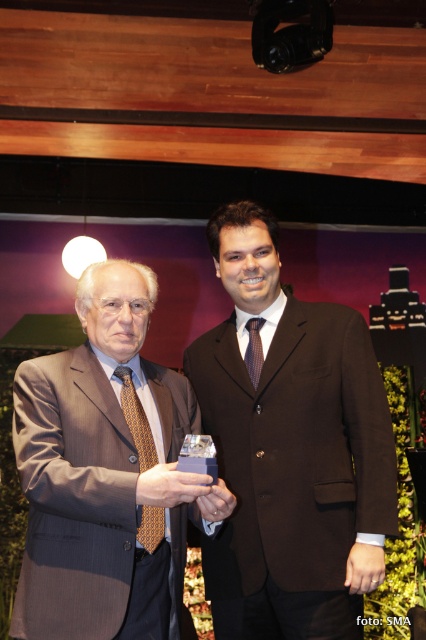
Question: Does brown suit at center come in front of matte brown suit at center?

Choices:
 (A) no
 (B) yes

Answer: (A)

Question: Is brown suit at center positioned at the back of matte brown suit at center?

Choices:
 (A) yes
 (B) no

Answer: (A)

Question: Which point appears closest to the camera in this image?

Choices:
 (A) 43,467
 (B) 255,637

Answer: (A)

Question: Which point is farther from the camera taking this photo?

Choices:
 (A) (158, 625)
 (B) (296, 417)

Answer: (B)

Question: Can you confirm if brown suit at center is smaller than matte brown suit at center?

Choices:
 (A) no
 (B) yes

Answer: (A)

Question: Which point is closer to the camera taking this photo?

Choices:
 (A) (290, 444)
 (B) (175, 592)

Answer: (B)